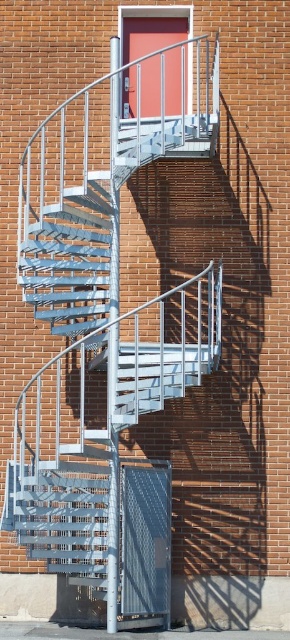
Is point (129, 611) in front of point (80, 323)?

Yes.

Does metallic silver fire escape at center appear over metallic silver staircase at center?

No, metallic silver fire escape at center is not above metallic silver staircase at center.

Where is `metallic silver fire escape at center`? metallic silver fire escape at center is located at coordinates (107, 332).